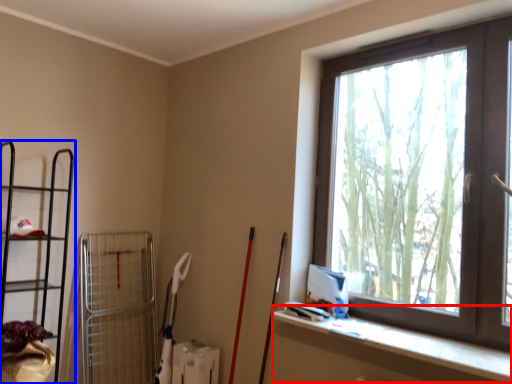
Question: Among these objects, which one is farthest to the camera, ledge (highlighted by a red box) or shelf (highlighted by a blue box)?

Choices:
 (A) ledge
 (B) shelf

Answer: (B)